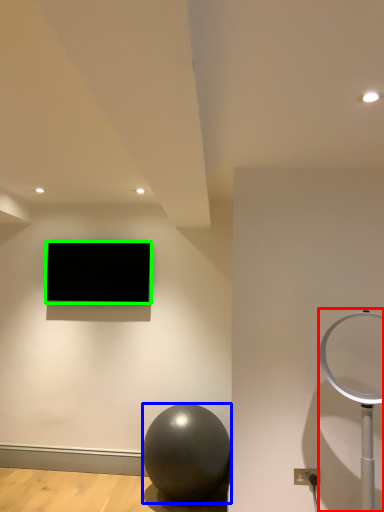
Question: Which object is positioned closest to table lamp (highlighted by a red box)? Select from ball (highlighted by a blue box) and television (highlighted by a green box).

Choices:
 (A) ball
 (B) television

Answer: (A)